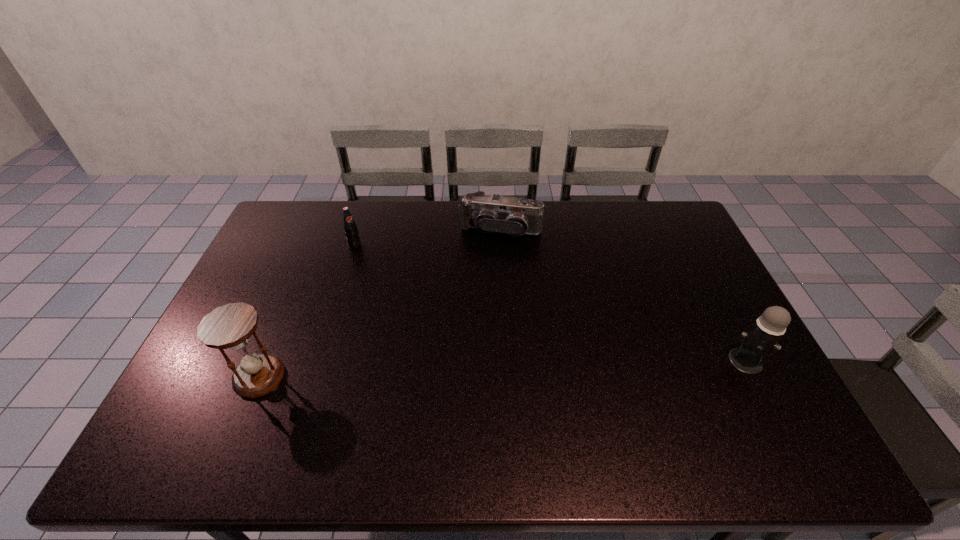
Locate an element on the screen. This screenshot has height=540, width=960. vacant region at the far right corner of the desktop is located at coordinates (666, 237).

Identify the location of vacant region between the rightmost object and the pop. (550, 303).

Find the location of `vacant space that's between the hourglass and the second object from left to right`. vacant space that's between the hourglass and the second object from left to right is located at coordinates (307, 311).

At what (x,y) coordinates should I click in order to perform the action: click on free spot between the leftmost object and the second object from right to left. Please return your answer as a coordinate pair (x, y). Looking at the image, I should click on (380, 303).

Identify the location of free spot between the leftmost object and the microphone. This screenshot has height=540, width=960. (502, 369).

Find the location of a particular element. free area in between the rightmost object and the hourglass is located at coordinates (502, 369).

Locate an element on the screen. Image resolution: width=960 pixels, height=540 pixels. free spot between the rightmost object and the hourglass is located at coordinates (502, 369).

Locate an element on the screen. unoccupied area between the pop and the microphone is located at coordinates (550, 303).

Locate an element on the screen. This screenshot has height=540, width=960. vacant area that lies between the pop and the rightmost object is located at coordinates (550, 303).

Locate an element on the screen. The height and width of the screenshot is (540, 960). vacant space that's between the camcorder and the hourglass is located at coordinates (380, 303).